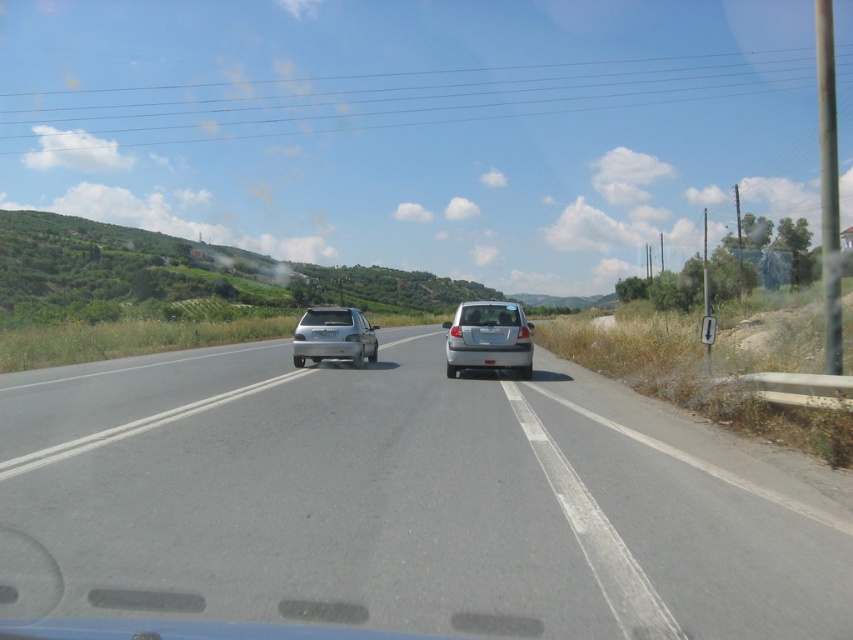
You are a driver navigating a two lane road. You see a point marked at coordinates (402,502). What object is located at that point?

The point at coordinates (402,502) corresponds to the gray asphalt road at center.

You are a passenger in the vehicle and notice two objects at the center of the road ahead. The objects are the satin silver suv at center and the white plastic license plate at center. Which object is closer to your vehicle?

The satin silver suv at center is closer to your vehicle because the white plastic license plate at center is behind it.

You are a passenger in a car and looking out the windshield. You see the gray asphalt road at center and the silver metallic car at center. Which object takes up more space in your view?

The gray asphalt road at center has a larger size compared to the silver metallic car at center, so the gray asphalt road at center takes up more space in your view.